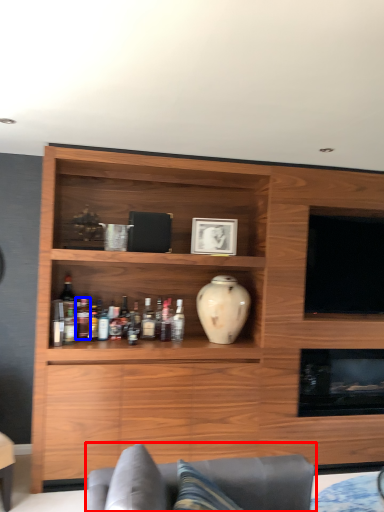
Question: Which of the following is the farthest to the observer, studio couch (highlighted by a red box) or bottle (highlighted by a blue box)?

Choices:
 (A) studio couch
 (B) bottle

Answer: (B)